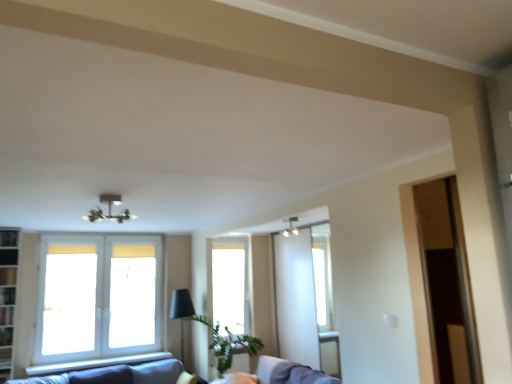
Question: Do you think metallic chandelier at upper center is within white glass window at left, which is counted as the 2th window, starting from the right, or outside of it?

Choices:
 (A) inside
 (B) outside

Answer: (B)

Question: Based on their sizes in the image, would you say metallic chandelier at upper center is bigger or smaller than white glass window at left, which ranks as the second window in back-to-front order?

Choices:
 (A) small
 (B) big

Answer: (A)

Question: Which object is the closest to the dark gray fabric couch at lower left?

Choices:
 (A) transparent glass window at center, the second window from the front
 (B) white glass window at left, which ranks as the second window in back-to-front order
 (C) black matte shelf at left
 (D) metallic chandelier at upper center
 (E) white fabric swivel chair at lower center

Answer: (B)

Question: Considering the real-world distances, which object is farthest from the metallic chandelier at upper center?

Choices:
 (A) white glass window at left, which is the 1th window from front to back
 (B) transparent glass window at center, the second window from the front
 (C) white fabric swivel chair at lower center
 (D) dark gray fabric couch at lower left
 (E) black matte shelf at left

Answer: (D)